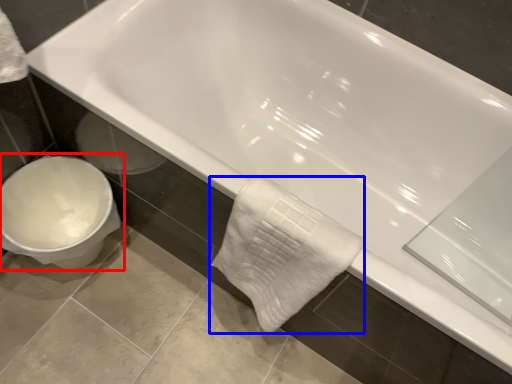
Question: Which object appears farthest to the camera in this image, toilet (highlighted by a red box) or bath towel (highlighted by a blue box)?

Choices:
 (A) toilet
 (B) bath towel

Answer: (A)